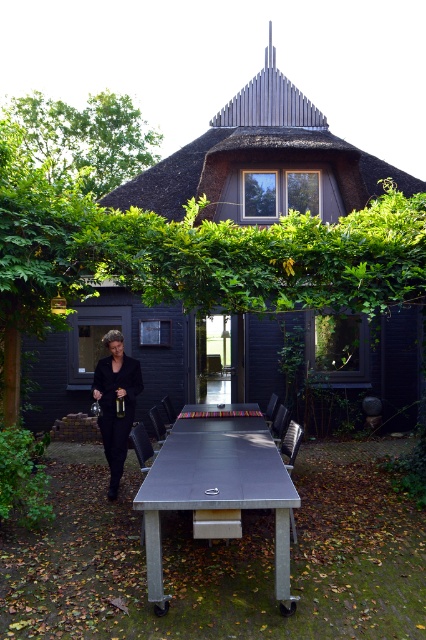
Question: Among these points, which one is farthest from the camera?

Choices:
 (A) (229, 506)
 (B) (120, 348)

Answer: (B)

Question: Can you confirm if metallic silver picnic table at center is bigger than black fabric coat at left?

Choices:
 (A) no
 (B) yes

Answer: (B)

Question: Which object is positioned farthest from the black fabric coat at left?

Choices:
 (A) metallic silver picnic table at center
 (B) dark gray wooden hut at center

Answer: (B)

Question: Among these points, which one is nearest to the camera?

Choices:
 (A) (109, 349)
 (B) (74, 376)
 (C) (241, 413)

Answer: (A)

Question: Does dark gray wooden hut at center have a smaller size compared to metallic silver picnic table at center?

Choices:
 (A) yes
 (B) no

Answer: (B)

Question: Is the position of dark gray wooden hut at center less distant than that of metallic silver picnic table at center?

Choices:
 (A) no
 (B) yes

Answer: (A)